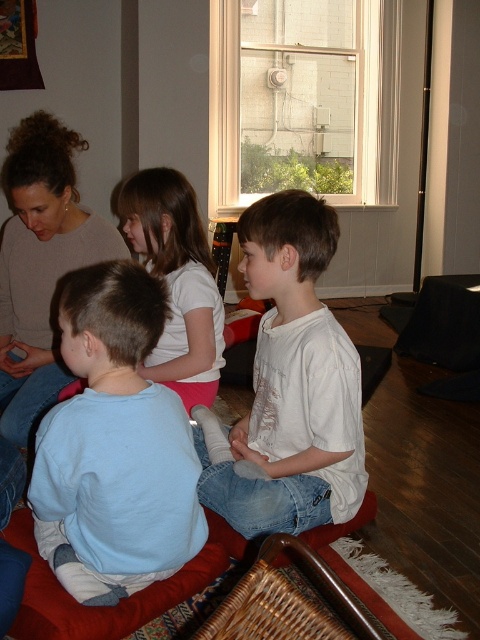
Question: Among these points, which one is farthest from the camera?

Choices:
 (A) (11, 458)
 (B) (165, 509)
 (C) (290, 317)
 (D) (149, 216)

Answer: (D)

Question: Which point is closer to the camera?

Choices:
 (A) (92, 465)
 (B) (46, 365)
 (C) (292, 438)

Answer: (A)

Question: Can you confirm if white cotton shirt at center is thinner than white matte shirt at center?

Choices:
 (A) yes
 (B) no

Answer: (B)

Question: Among these objects, which one is nearest to the camera?

Choices:
 (A) light blue cotton shirt at lower left
 (B) white cotton shirt at center
 (C) white matte shirt at center

Answer: (A)

Question: Is light blue cotton shirt at lower left further to the viewer compared to matte beige sweater at upper left?

Choices:
 (A) no
 (B) yes

Answer: (A)

Question: Can you confirm if light blue cotton shirt at lower left is positioned to the left of white matte shirt at center?

Choices:
 (A) yes
 (B) no

Answer: (A)